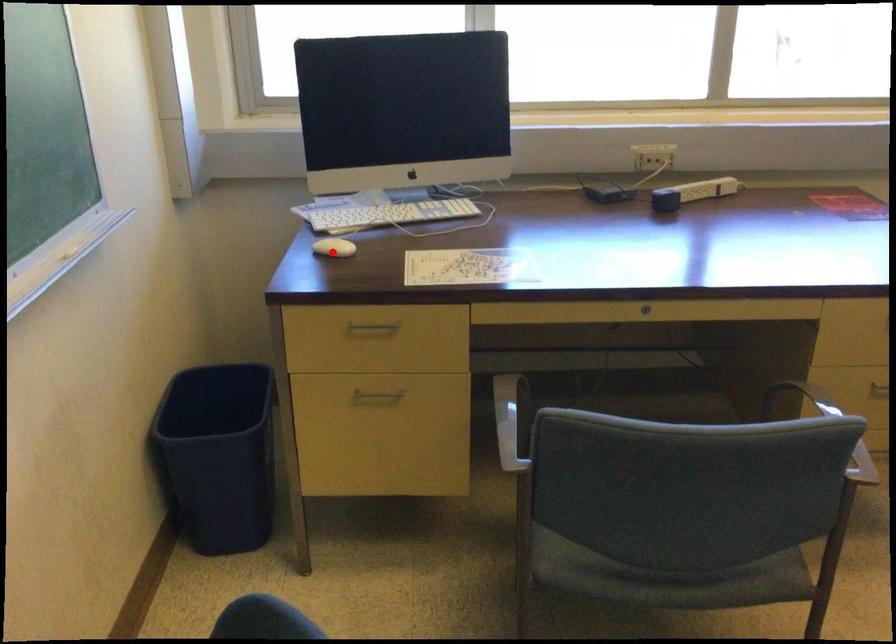
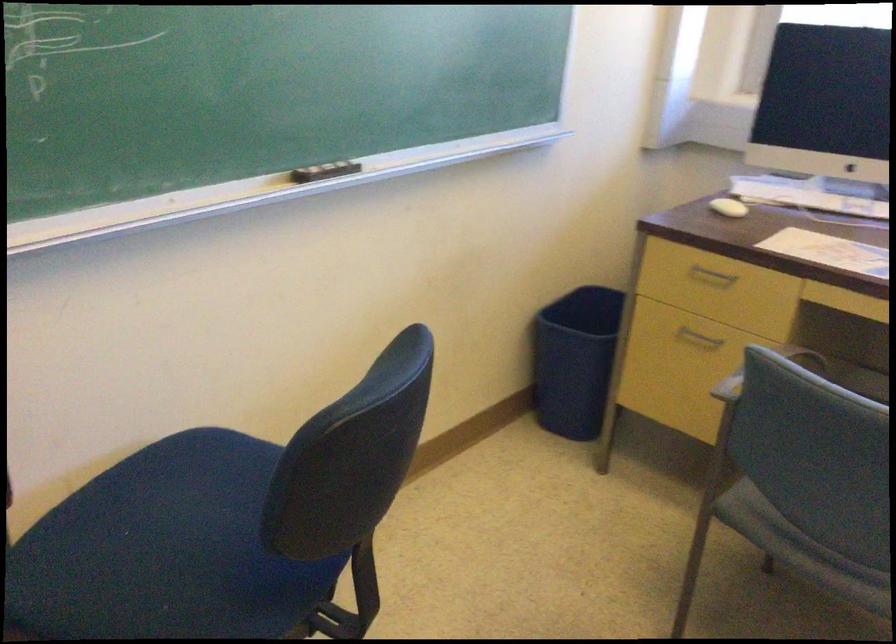
Question: I am providing you with two images of the same scene from different viewpoints. Image1 has a red point marked. In image2, the corresponding 3D location appears at what relative position? Reply with the corresponding letter.

Choices:
 (A) Closer
 (B) Farther

Answer: (B)